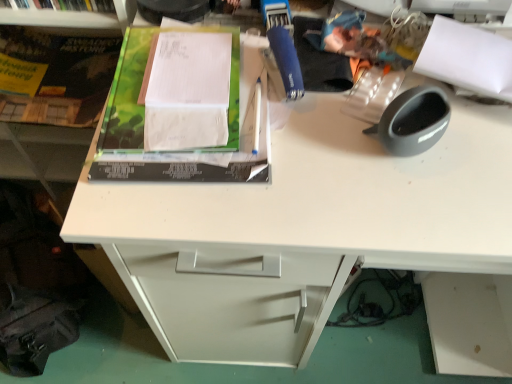
Where is `empty space that is ontop of green matte paper at upper left, the 2th paperback book viewed from the back (from a real-world perspective)`? empty space that is ontop of green matte paper at upper left, the 2th paperback book viewed from the back (from a real-world perspective) is located at coordinates (183, 80).